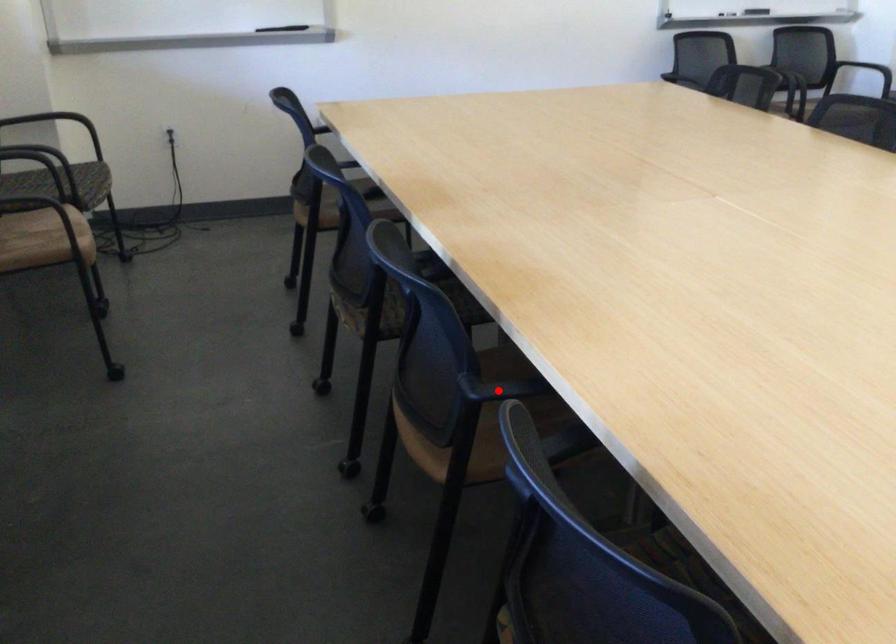
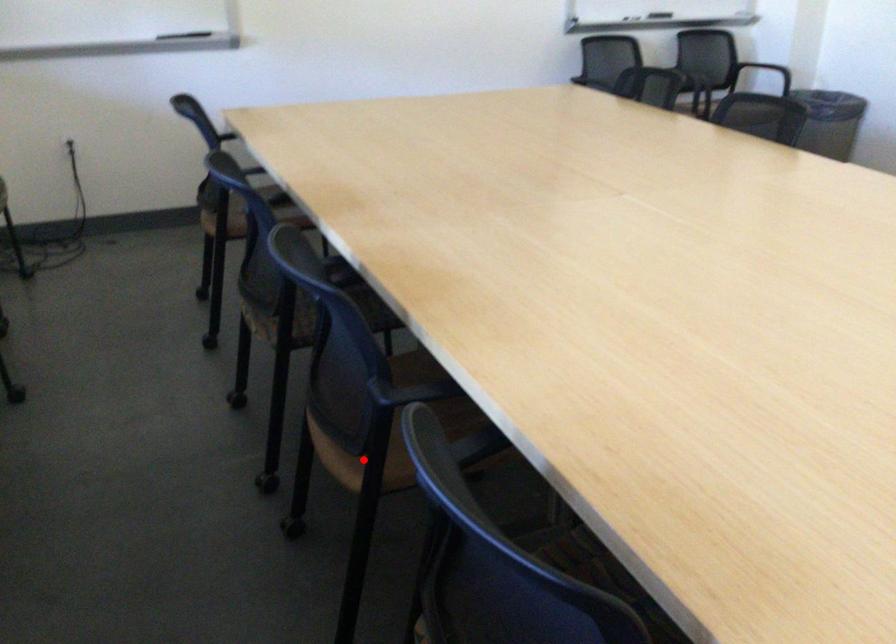
I am providing you with two images of the same scene from different viewpoints. A red point is marked on the first image and another point is marked on the second image. Are the points marked in image1 and image2 representing the same 3D position?

No